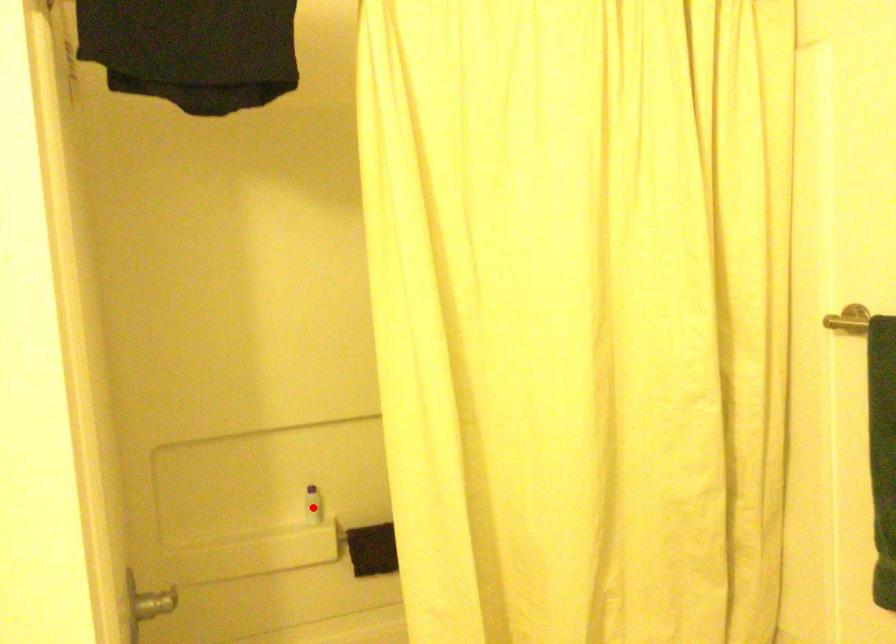
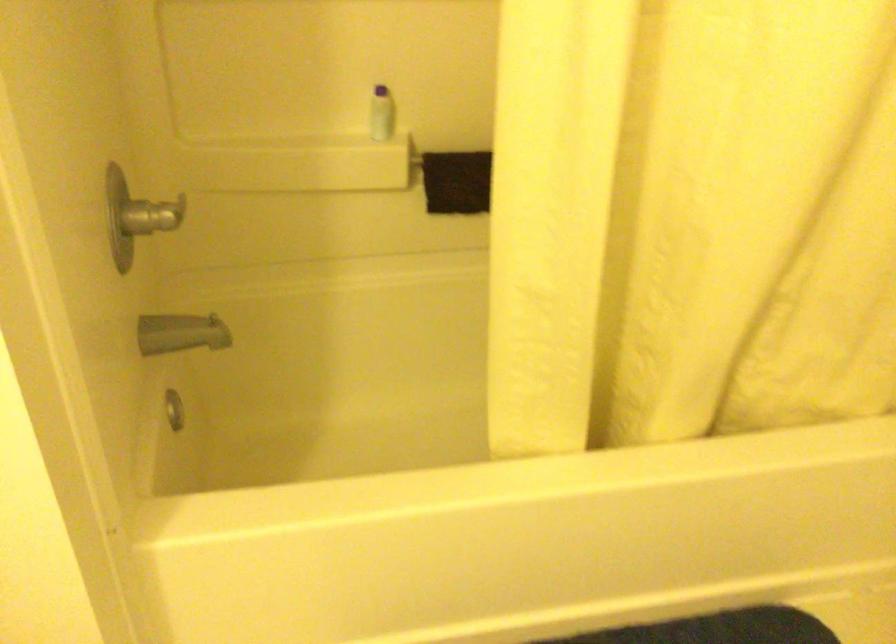
Find the pixel in the second image that matches the highlighted location in the first image.

(382, 114)